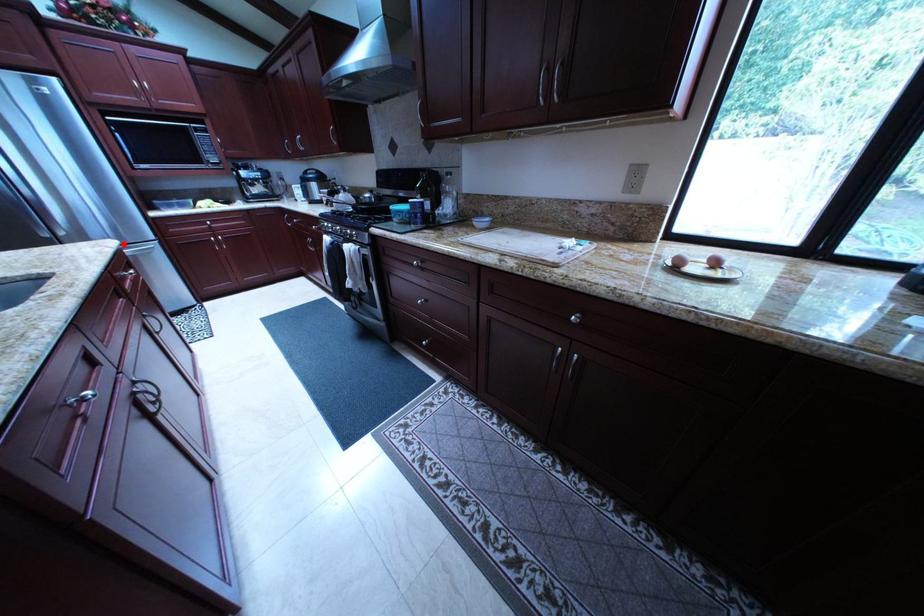
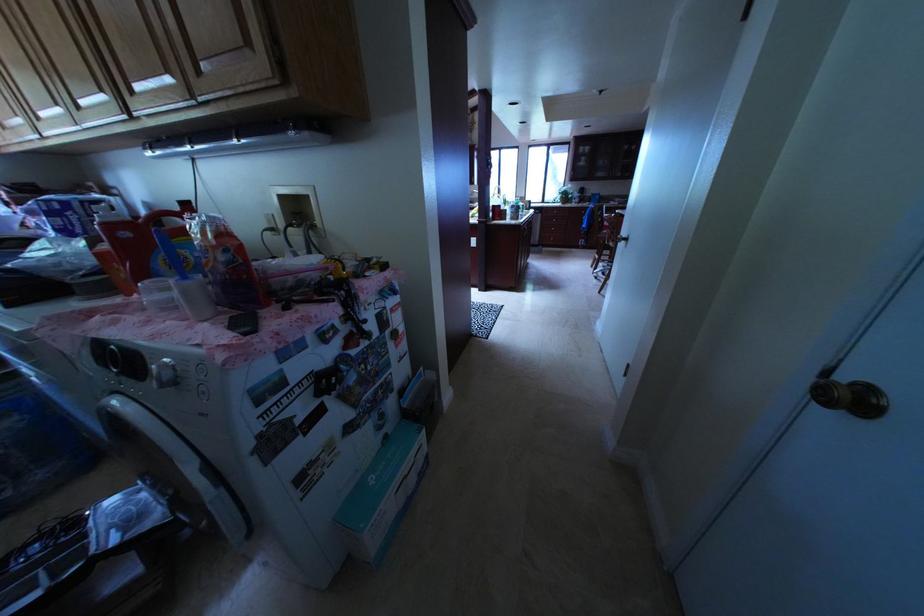
Question: I am providing you with two images of the same scene from different viewpoints. A red point is marked on the first image. Is the red point's position out of view in image 2?

Choices:
 (A) Yes
 (B) No

Answer: (A)